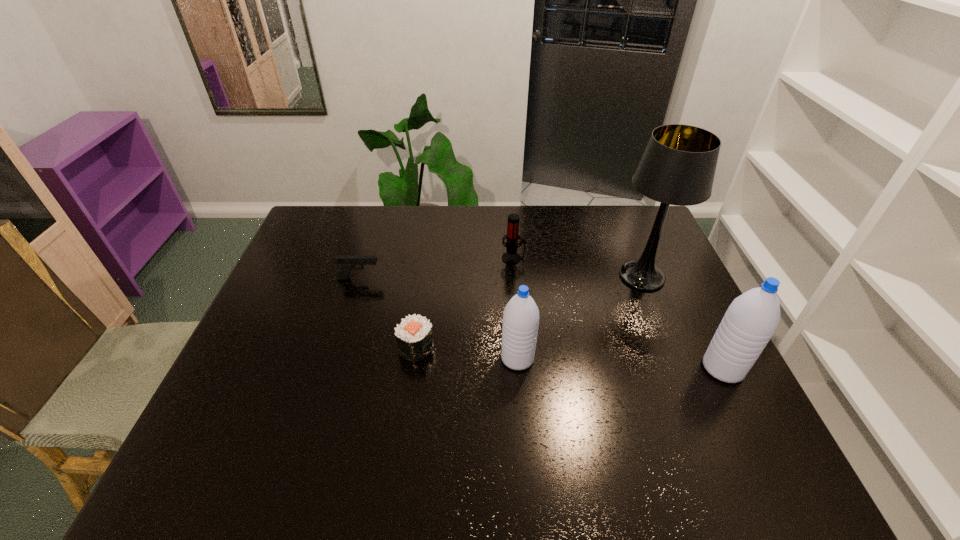
This screenshot has height=540, width=960. Find the location of `free point at the far right corner`. free point at the far right corner is located at coordinates (664, 240).

Image resolution: width=960 pixels, height=540 pixels. I want to click on free space at the near right corner, so click(x=687, y=433).

The width and height of the screenshot is (960, 540). Identify the location of unoccupied position between the taller water bottle and the shorter water bottle. (620, 363).

Where is `free space between the right water bottle and the tallest object`? This screenshot has height=540, width=960. free space between the right water bottle and the tallest object is located at coordinates (683, 322).

In order to click on empty space between the second object from left to right and the fourth tallest object in this screenshot , I will do tap(465, 303).

Where is `free space between the right water bottle and the microphone`? This screenshot has width=960, height=540. free space between the right water bottle and the microphone is located at coordinates (618, 313).

Where is `vacant space in between the fourth shortest object and the second tallest object`? This screenshot has height=540, width=960. vacant space in between the fourth shortest object and the second tallest object is located at coordinates (620, 363).

At what (x,y) coordinates should I click in order to perform the action: click on unoccupied area between the taller water bottle and the microphone. Please return your answer as a coordinate pair (x, y). This screenshot has width=960, height=540. Looking at the image, I should click on (618, 313).

Identify the location of free space between the tallest object and the taller water bottle. This screenshot has width=960, height=540. (683, 322).

This screenshot has height=540, width=960. What are the coordinates of `unoccupied position between the left water bottle and the fifth object from right to left` in the screenshot? It's located at (467, 353).